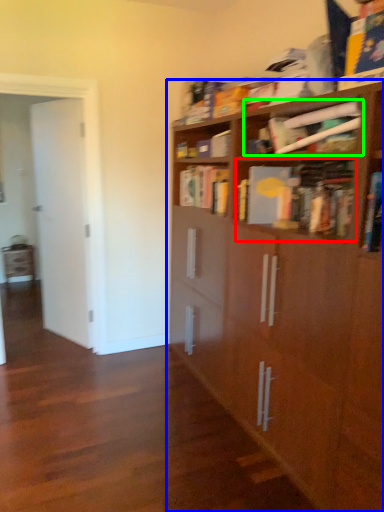
Question: Considering the real-world distances, which object is farthest from book (highlighted by a red box)? bookcase (highlighted by a blue box) or book (highlighted by a green box)?

Choices:
 (A) bookcase
 (B) book

Answer: (A)